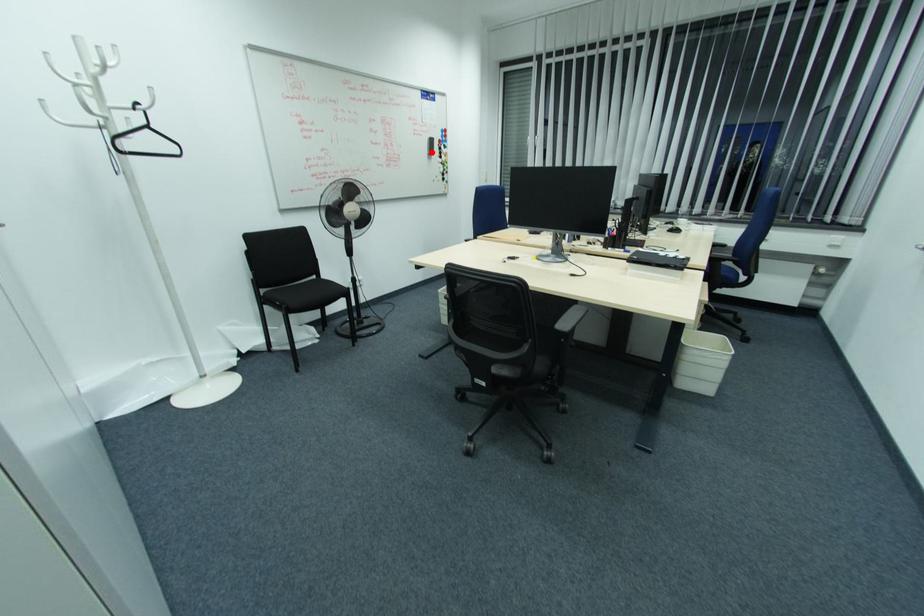
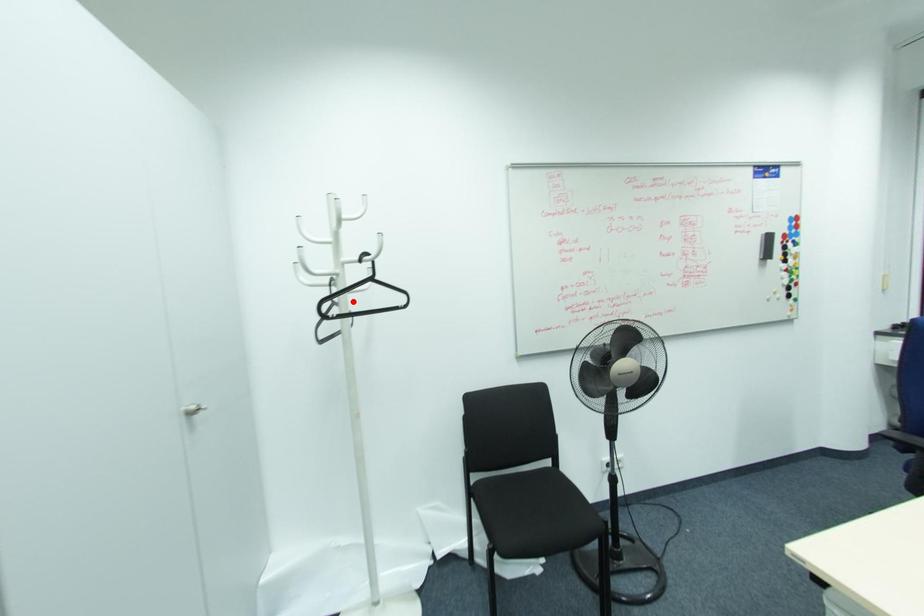
I am providing you with two images of the same scene from different viewpoints. A red point is marked on the first image and another point is marked on the second image. Is the red point in image1 aligned with the point shown in image2?

No